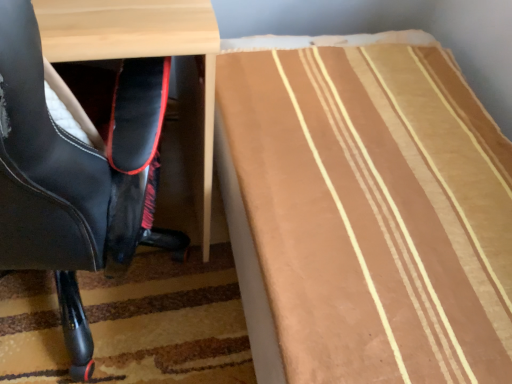
Where is `free space above brown striped fabric at lower right (from a real-world perspective)`? free space above brown striped fabric at lower right (from a real-world perspective) is located at coordinates (337, 110).